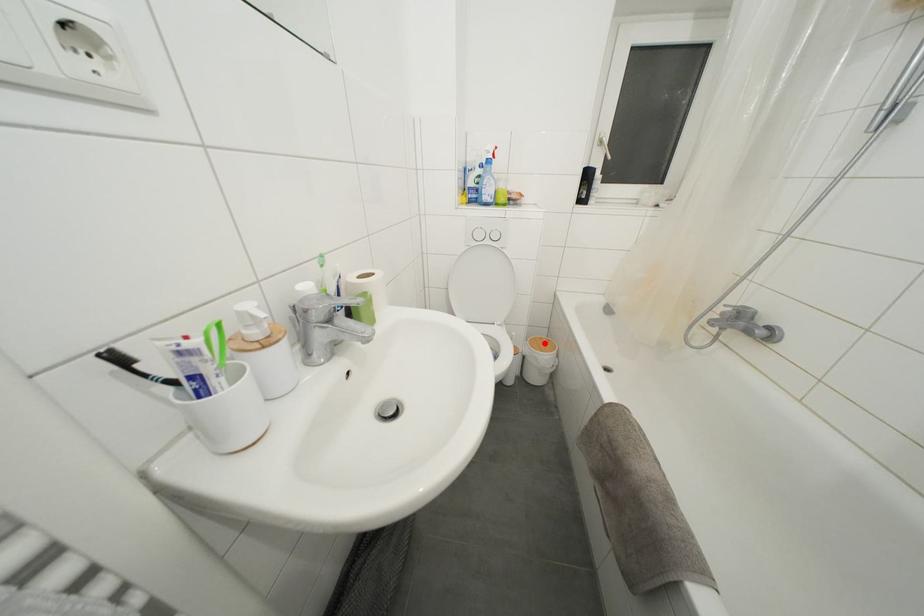
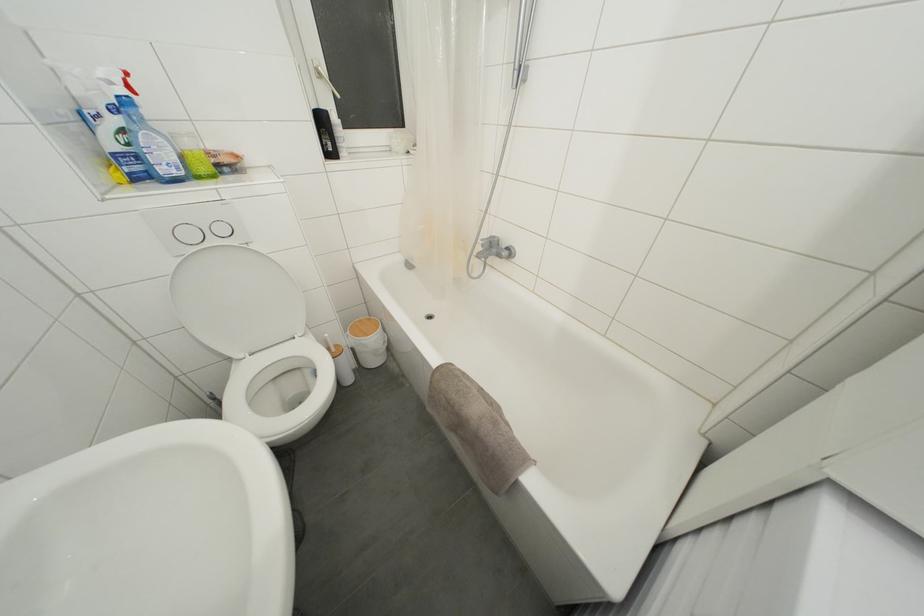
Question: I am providing you with two images of the same scene from different viewpoints. Given a red point in image1, look at the same physical point in image2. Is it:

Choices:
 (A) Closer to the viewpoint
 (B) Farther from the viewpoint

Answer: (A)